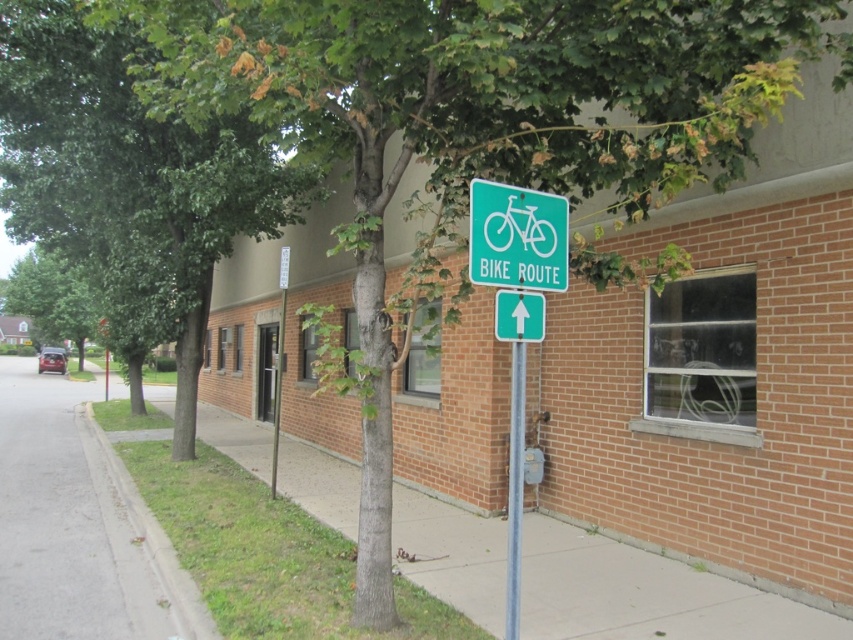
Question: Considering the real-world distances, which object is farthest from the gray asphalt at lower left?

Choices:
 (A) white plastic sign at upper center
 (B) green leafy tree at left
 (C) metallic pole at center
 (D) gray concrete sidewalk at center

Answer: (B)

Question: Which point is farther from the camera taking this photo?

Choices:
 (A) (282, 353)
 (B) (527, 253)
 (C) (25, 282)

Answer: (C)

Question: Observing the image, what is the correct spatial positioning of green plastic bike route sign at center in reference to silver metallic pole at center?

Choices:
 (A) below
 (B) above

Answer: (B)

Question: Is green plastic bike route sign at center above green leafy tree at left?

Choices:
 (A) no
 (B) yes

Answer: (A)

Question: Estimate the real-world distances between objects in this image. Which object is closer to the green leafy tree at center?

Choices:
 (A) gray concrete sidewalk at center
 (B) gray asphalt at lower left

Answer: (A)

Question: Does gray concrete sidewalk at center appear on the left side of green plastic bike route sign at center?

Choices:
 (A) yes
 (B) no

Answer: (A)